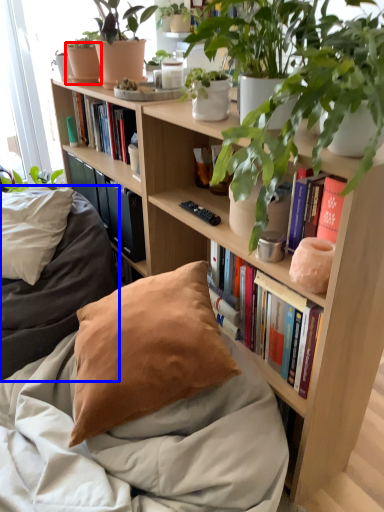
Question: Which of the following is the farthest to the observer, flowerpot (highlighted by a red box) or bedding (highlighted by a blue box)?

Choices:
 (A) flowerpot
 (B) bedding

Answer: (A)